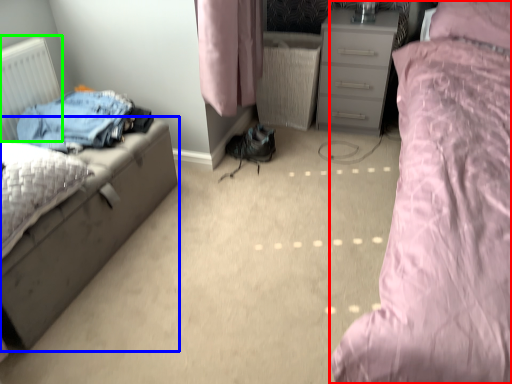
Question: Which is nearer to the bed (highlighted by a red box)? nightstand (highlighted by a blue box) or radiator (highlighted by a green box).

Choices:
 (A) nightstand
 (B) radiator

Answer: (A)